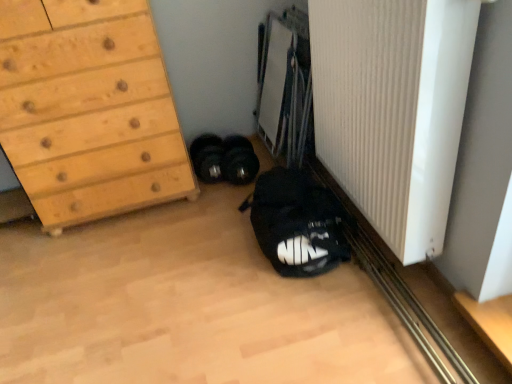
Find the location of `free space in front of black fabric backpack at lower center`. free space in front of black fabric backpack at lower center is located at coordinates (292, 316).